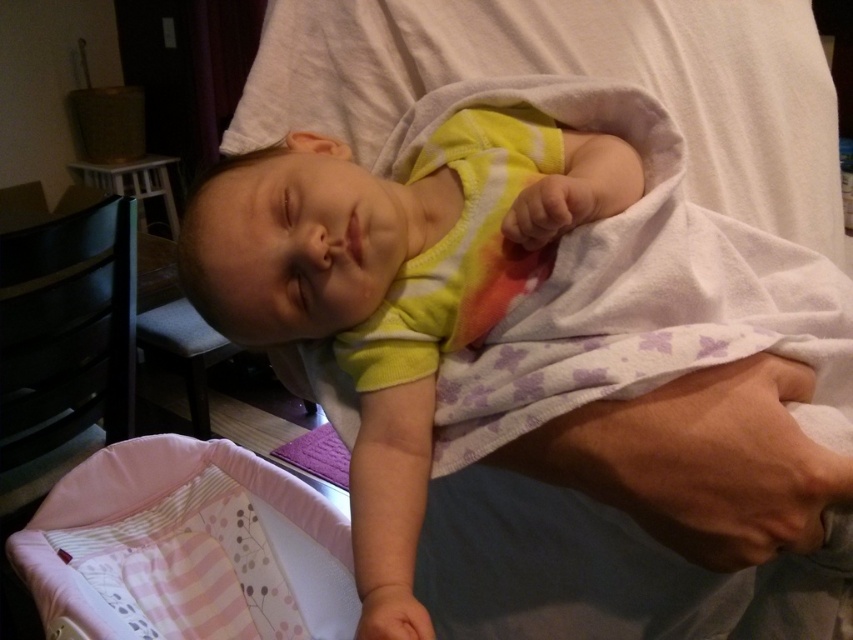
You are standing in the room and see two points marked in the image. Which point is closer to you, the point at coordinate [616,536] or the point at [317,522]?

Point at coordinate [616,536] is in front of point at [317,522], so it is closer to you.

You are a photographer trying to capture the baby in the yellow cotton onesie at center. If your camera has a focus point at the center of the image, which is at coordinate point 0.5, 0.5, will the focus point align with the baby?

The yellow cotton onesie at center is positioned at point (x=633, y=291), which is slightly to the left and above the camera focus point at (x=426, y=320). Therefore, the focus point will not align perfectly with the baby.

You are a photographer setting up for a baby photo shoot. You need to ensure the yellow cotton onesie at center and the pink fabric infant bed at lower left are both visible in the frame. Based on their sizes, which object should you focus on first to ensure they both fit in the shot?

The yellow cotton onesie at center is taller than the pink fabric infant bed at lower left. To ensure both fit in the frame, focus on positioning the camera so the taller yellow cotton onesie at center is centered, then adjust the frame to include the smaller pink fabric infant bed at lower left.